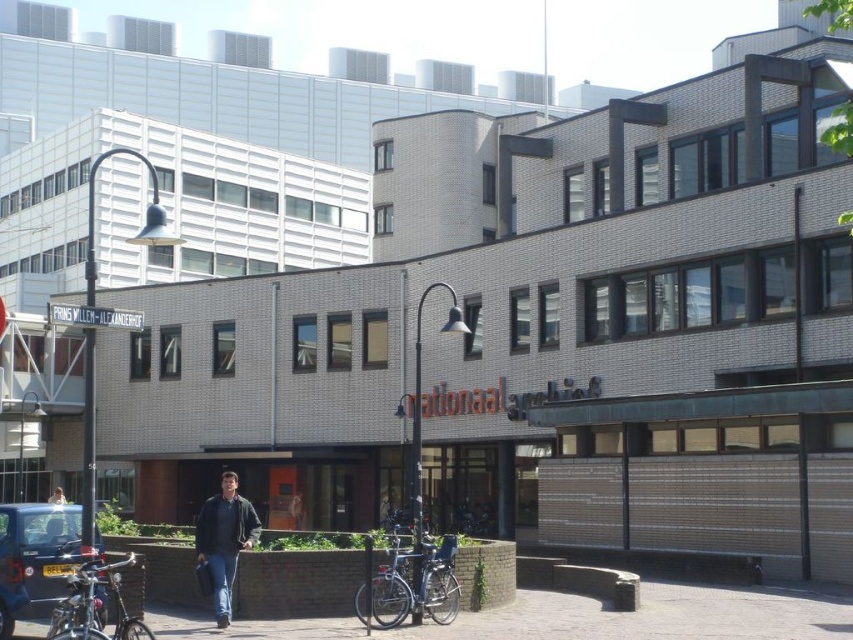
You are standing in front of the Nationaal Archief building and see a shiny metallic bicycle at lower left and light blue jeans at center. Which object is located to the right side of the other?

The shiny metallic bicycle at lower left is to the right of light blue jeans at center.

You are standing at the entrance of the Nationaal Archief building and need to park your bicycle. The entrance is located at point 0.5, 0.5. Can you determine the direction you need to walk to reach the shiny metallic bicycle at lower left?

The shiny metallic bicycle at lower left is located at point (96, 604), which is to the right and below the entrance at (426, 320). Therefore, you should walk towards the lower right direction to reach it.

You are a photographer trying to capture a photo of the Nationaal Archief building. You notice the dark blue jeans at center and the shiny metallic bicycle at lower left in your frame. Which object should you move closer to ensure it fills more of your camera view?

The dark blue jeans at center has a larger size compared to the shiny metallic bicycle at lower left, so moving closer to the dark blue jeans at center will make it fill more of the camera view.